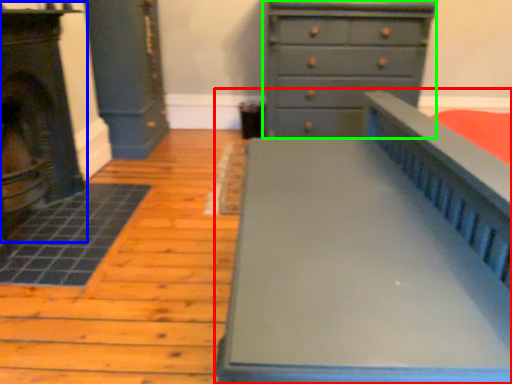
Question: Based on their relative distances, which object is farther from furniture (highlighted by a red box)? Choose from fireplace (highlighted by a blue box) and chest of drawers (highlighted by a green box).

Choices:
 (A) fireplace
 (B) chest of drawers

Answer: (B)